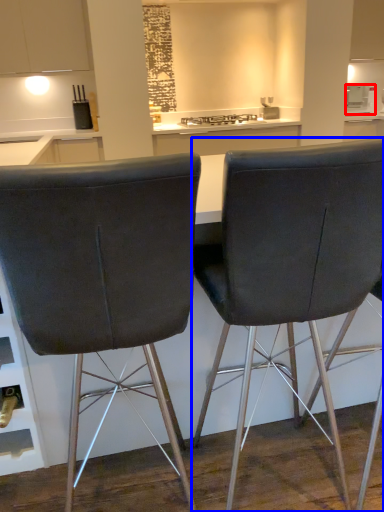
Question: Which object is further to the camera taking this photo, appliance (highlighted by a red box) or chair (highlighted by a blue box)?

Choices:
 (A) appliance
 (B) chair

Answer: (A)